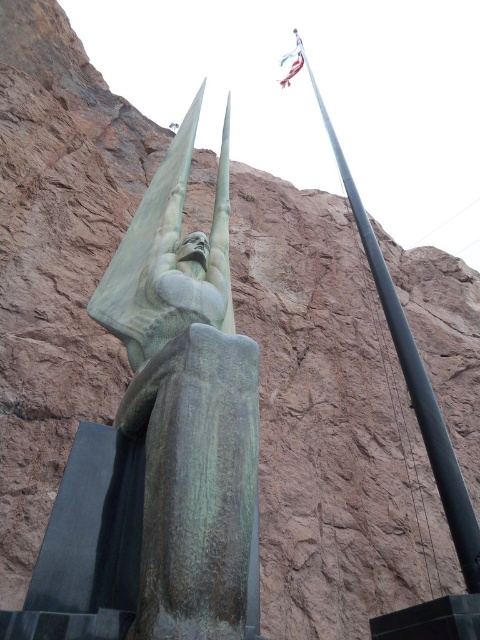
Question: Does green patina statue at center have a smaller size compared to black metallic pole at upper right?

Choices:
 (A) yes
 (B) no

Answer: (A)

Question: Which point is closer to the camera taking this photo?

Choices:
 (A) (451, 477)
 (B) (177, 538)

Answer: (B)

Question: Can you confirm if green patina statue at center is thinner than black metallic pole at upper right?

Choices:
 (A) no
 (B) yes

Answer: (B)

Question: Is green patina statue at center positioned at the back of black metallic pole at upper right?

Choices:
 (A) no
 (B) yes

Answer: (A)

Question: Which point appears farthest from the camera in this image?

Choices:
 (A) pos(420,388)
 (B) pos(207,508)

Answer: (A)